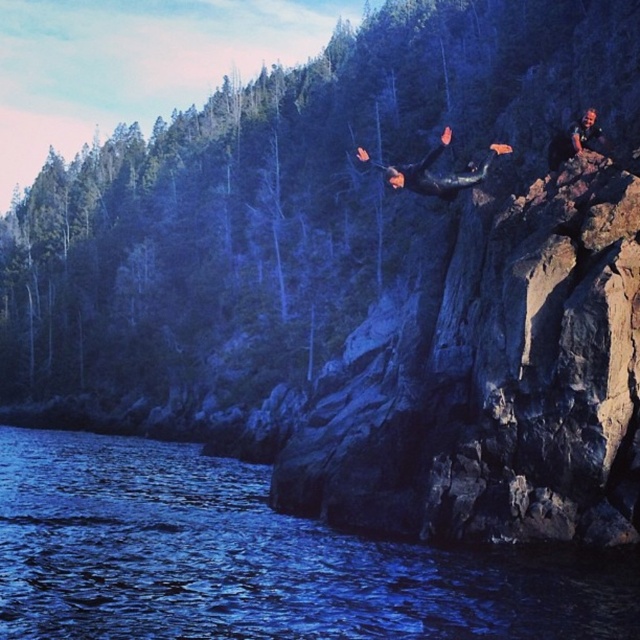
Question: In this image, where is black matte wetsuit at center located relative to camouflage fabric diver at upper right?

Choices:
 (A) above
 (B) below

Answer: (A)

Question: Can you confirm if blue liquid water at lower left is positioned below black matte wetsuit at center?

Choices:
 (A) no
 (B) yes

Answer: (B)

Question: From the image, what is the correct spatial relationship of blue liquid water at lower left in relation to black matte wetsuit at center?

Choices:
 (A) left
 (B) right

Answer: (A)

Question: Which point appears closest to the camera in this image?

Choices:
 (A) (193, 484)
 (B) (586, 140)

Answer: (B)

Question: Among these objects, which one is farthest from the camera?

Choices:
 (A) blue liquid water at lower left
 (B) black matte wetsuit at center

Answer: (B)

Question: Among these objects, which one is nearest to the camera?

Choices:
 (A) camouflage fabric diver at upper right
 (B) blue liquid water at lower left

Answer: (B)